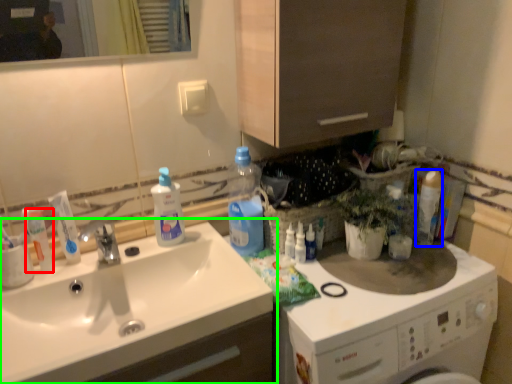
Question: Considering the real-world distances, which object is closest to toiletry (highlighted by a red box)? cleaning product (highlighted by a blue box) or sink (highlighted by a green box).

Choices:
 (A) cleaning product
 (B) sink

Answer: (B)